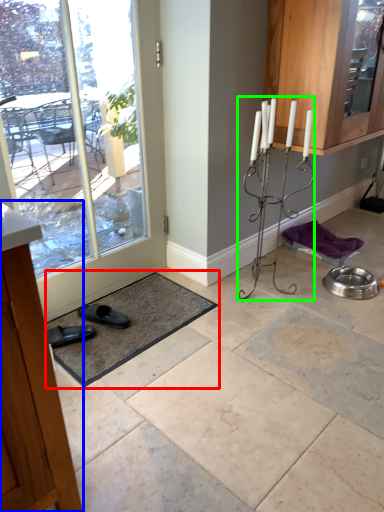
Question: Based on their relative distances, which object is farther from bath mat (highlighted by a red box)? Choose from cabinetry (highlighted by a blue box) and candle holder (highlighted by a green box).

Choices:
 (A) cabinetry
 (B) candle holder

Answer: (A)